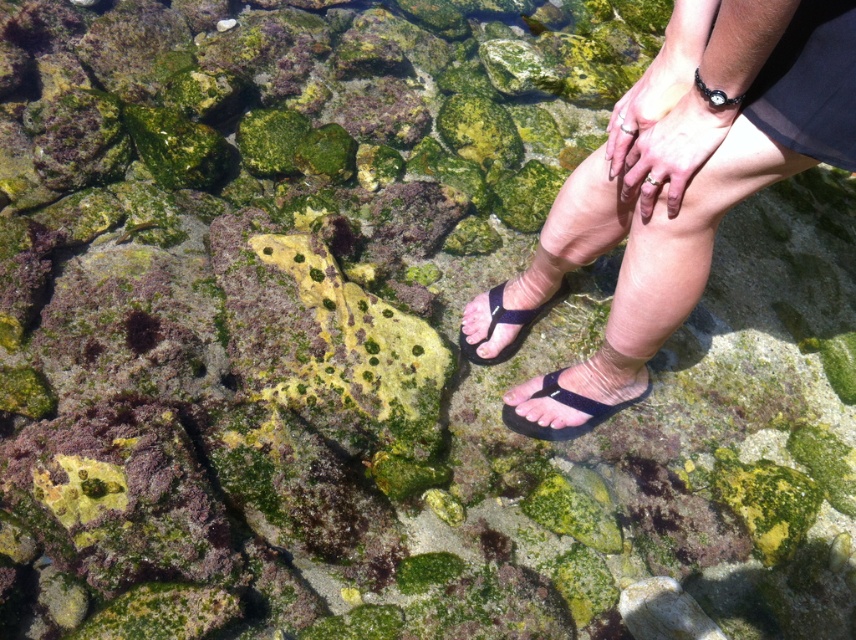
Does black rubber sandals at lower center have a lesser height compared to black rubber sandal at lower right?

In fact, black rubber sandals at lower center may be taller than black rubber sandal at lower right.

Can you confirm if black rubber sandals at lower center is positioned below black rubber sandal at lower right?

Incorrect, black rubber sandals at lower center is not positioned below black rubber sandal at lower right.

The image size is (856, 640). Find the location of `black rubber sandals at lower center`. black rubber sandals at lower center is located at coordinates (676, 188).

Locate an element on the screen. This screenshot has width=856, height=640. black rubber sandals at lower center is located at coordinates (676, 188).

Who is lower down, black rubber sandal at lower right or black rubber flip-flop at center?

black rubber sandal at lower right is lower down.

From the picture: Can you confirm if black rubber sandal at lower right is thinner than black rubber flip-flop at center?

No, black rubber sandal at lower right is not thinner than black rubber flip-flop at center.

What are the coordinates of `black rubber sandal at lower right` in the screenshot? It's located at (568, 404).

Between black rubber sandals at lower center and black rubber flip-flop at center, which one appears on the left side from the viewer's perspective?

black rubber flip-flop at center is more to the left.

What do you see at coordinates (676, 188) in the screenshot? The width and height of the screenshot is (856, 640). I see `black rubber sandals at lower center` at bounding box center [676, 188].

Image resolution: width=856 pixels, height=640 pixels. I want to click on black rubber sandals at lower center, so point(676,188).